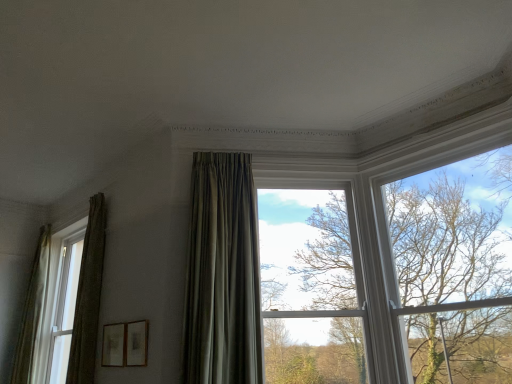
Question: Is matte white window at left, which is counted as the first window, starting from the left, at the right side of satin green curtain at center, the third curtain when ordered from back to front?

Choices:
 (A) yes
 (B) no

Answer: (B)

Question: Does matte white window at left, the 1th window when ordered from back to front, have a greater height compared to satin green curtain at center, the third curtain when ordered from back to front?

Choices:
 (A) no
 (B) yes

Answer: (B)

Question: Does matte white window at left, which is counted as the first window, starting from the left, have a greater width compared to satin green curtain at center, the third curtain when ordered from back to front?

Choices:
 (A) no
 (B) yes

Answer: (A)

Question: Is matte white window at left, the second window viewed from the front, smaller than satin green curtain at center, the third curtain when ordered from back to front?

Choices:
 (A) no
 (B) yes

Answer: (A)

Question: Is matte white window at left, marked as the 2th window in a right-to-left arrangement, placed right next to satin green curtain at center, arranged as the third curtain when viewed from the left?

Choices:
 (A) no
 (B) yes

Answer: (A)

Question: Based on their positions, is matte white window at left, the 1th window when ordered from back to front, located to the left or right of clear glass window at center, which is counted as the 2th window, starting from the back?

Choices:
 (A) right
 (B) left

Answer: (B)

Question: Is matte white window at left, the second window viewed from the front, wider or thinner than clear glass window at center, which is counted as the 2th window, starting from the back?

Choices:
 (A) wide
 (B) thin

Answer: (A)

Question: From a real-world perspective, is matte white window at left, which is counted as the first window, starting from the left, above or below clear glass window at center, the 1th window when ordered from right to left?

Choices:
 (A) above
 (B) below

Answer: (A)

Question: From the image's perspective, is matte white window at left, marked as the 2th window in a right-to-left arrangement, positioned above or below clear glass window at center, which is counted as the 2th window, starting from the back?

Choices:
 (A) above
 (B) below

Answer: (B)

Question: Is silky green curtain at left, which is counted as the third curtain, starting from the right, to the left or to the right of satin green curtain at center, marked as the 1th curtain in a right-to-left arrangement, in the image?

Choices:
 (A) left
 (B) right

Answer: (A)

Question: In terms of width, does silky green curtain at left, the 1th curtain viewed from the back, look wider or thinner when compared to satin green curtain at center, the third curtain when ordered from back to front?

Choices:
 (A) thin
 (B) wide

Answer: (A)

Question: Considering the positions of point (16, 367) and point (246, 329), is point (16, 367) closer or farther from the camera than point (246, 329)?

Choices:
 (A) farther
 (B) closer

Answer: (A)

Question: In terms of height, does silky green curtain at left, the third curtain from the front, look taller or shorter compared to satin green curtain at center, the 1th curtain in the front-to-back sequence?

Choices:
 (A) tall
 (B) short

Answer: (A)

Question: From their relative heights in the image, would you say green textured curtain at left, acting as the 2th curtain starting from the back, is taller or shorter than matte white window at left, the second window viewed from the front?

Choices:
 (A) short
 (B) tall

Answer: (A)

Question: From a real-world perspective, is green textured curtain at left, the second curtain from the right, positioned above or below matte white window at left, the second window viewed from the front?

Choices:
 (A) below
 (B) above

Answer: (B)